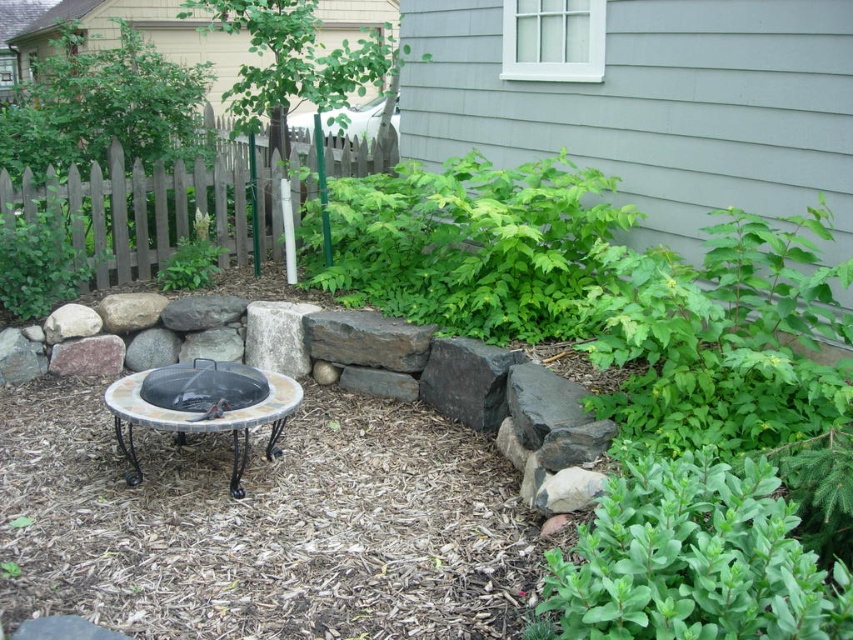
You are planning to install a new pathway between the green leafy plant at lower right and the green leafy plant at left. Given that the pathway requires a minimum of 10 feet of space, will there be enough room?

The green leafy plant at lower right and the green leafy plant at left are 12.89 feet apart, which exceeds the required 10 feet for the pathway. Therefore, there is sufficient space to install the pathway between them.

You are standing at the camera position and want to water the green leafy plant at lower right. If your watering can has a range of 1.5 meters, can you reach the plant without moving closer?

The distance between you and the green leafy plant at lower right is 1.71 meters, which is beyond the watering can range of 1.5 meters. You need to move closer to water it.

You are planning to place a small decorative statue that is 10 inches tall next to the green leafy plant at lower right and the gray rough stone at center. Based on their sizes, which object would allow the statue to be more visible when placed next to it?

The gray rough stone at center is smaller in size than the green leafy plant at lower right. Placing the statue next to the gray rough stone at center would make it more visible since the statue would stand out against a smaller object.